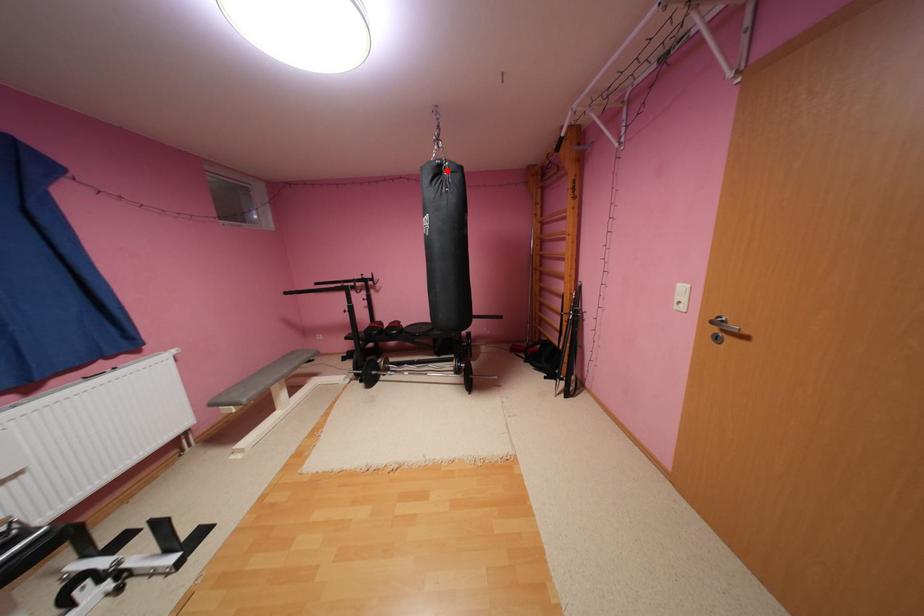
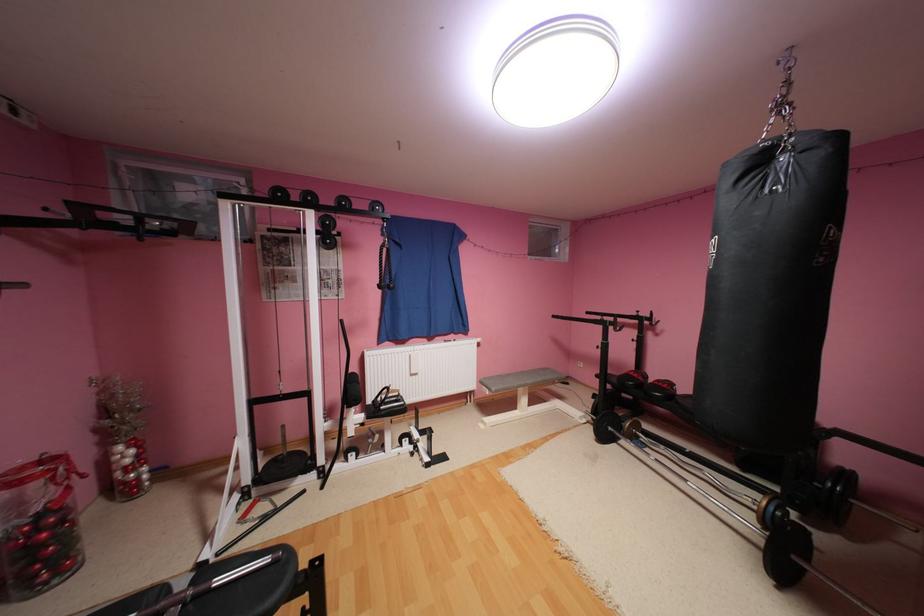
Locate, in the second image, the point that corresponds to the highlighted location in the first image.

(769, 161)